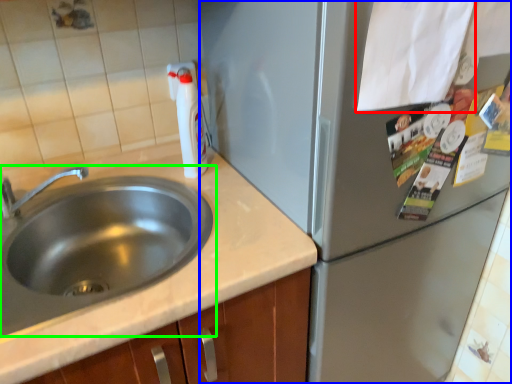
Question: Which object is the closest to the paper (highlighted by a red box)? Choose among these: appliance (highlighted by a blue box) or sink (highlighted by a green box).

Choices:
 (A) appliance
 (B) sink

Answer: (A)